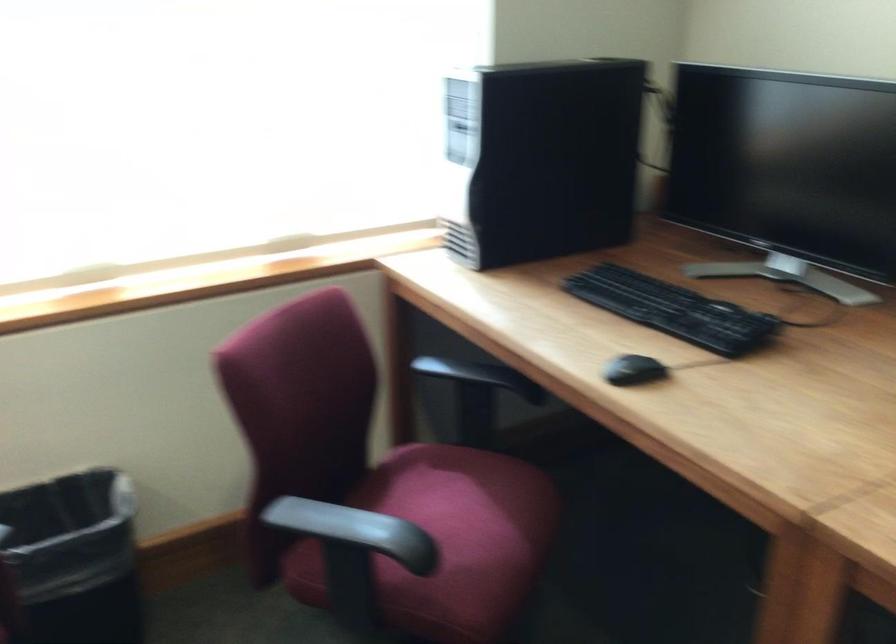
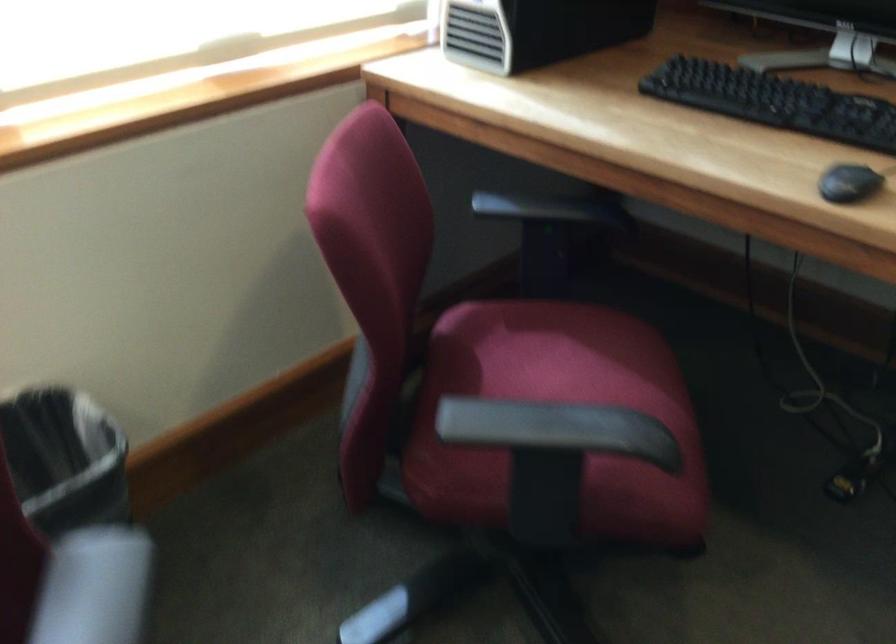
Find the pixel in the second image that matches point 622,374 in the first image.

(848, 183)